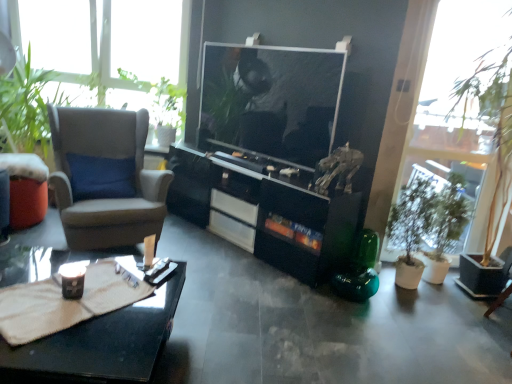
The image size is (512, 384). Find the location of `black glossy cabinet at center`. black glossy cabinet at center is located at coordinates (268, 210).

In order to face green matte plant at right, should I rotate leftwards or rightwards?

It's best to rotate right around 20.157 degrees.

You are a GUI agent. You are given a task and a screenshot of the screen. Output one action in this format:
    pyautogui.click(x=<x>, y=<y>)
    Task: Click on the black glossy coffee table at lower left
    This screenshot has height=384, width=512.
    Given the screenshot: What is the action you would take?
    pyautogui.click(x=101, y=344)

From the image's perspective, which one is positioned higher, matte orange table at left or black glossy cabinet at center?

matte orange table at left, from the image's perspective.

Is matte orange table at left oriented away from black glossy cabinet at center?

No, matte orange table at left is not facing the opposite direction of black glossy cabinet at center.

Can you confirm if matte orange table at left is smaller than black glossy cabinet at center?

Yes.

Would you say matte orange table at left is a long distance from black glossy cabinet at center?

Yes, matte orange table at left and black glossy cabinet at center are quite far apart.

From the picture: From a real-world perspective, is green matte plant at right on top of gray fabric armchair at left?

No.

Between point (451, 212) and point (142, 130), which one is positioned behind?

Positioned behind is point (142, 130).

Considering the positions of objects green matte plant at right and gray fabric armchair at left in the image provided, who is more to the left, green matte plant at right or gray fabric armchair at left?

gray fabric armchair at left is more to the left.

Is green matte plant at right outside of gray fabric armchair at left?

green matte plant at right lies outside gray fabric armchair at left's area.

From the image's perspective, is matte orange table at left on top of green matte plant at right?

Correct, matte orange table at left appears higher than green matte plant at right in the image.

Which is behind, point (42, 175) or point (449, 246)?

Point (449, 246)

Is matte orange table at left next to green matte plant at right and touching it?

No, matte orange table at left is not with green matte plant at right.

Is matte orange table at left facing away from green matte plant at right?

No, green matte plant at right is not at the back of matte orange table at left.

Considering the relative sizes of green matte plant at right and green leafy plant at right in the image provided, is green matte plant at right smaller than green leafy plant at right?

Indeed, green matte plant at right has a smaller size compared to green leafy plant at right.

Is green matte plant at right positioned behind green leafy plant at right?

Yes, it is.

From a real-world perspective, which is physically above, green matte plant at right or green leafy plant at right?

green leafy plant at right.

Is black glossy coffee table at lower left not inside green leafy plant at right?

Absolutely, black glossy coffee table at lower left is external to green leafy plant at right.

Is black glossy coffee table at lower left placed right next to green leafy plant at right?

They are not placed beside each other.

From a real-world perspective, between black glossy coffee table at lower left and green leafy plant at right, who is vertically lower?

black glossy coffee table at lower left, from a real-world perspective.

Does point (60, 119) come farther from viewer compared to point (390, 226)?

No, (60, 119) is in front of (390, 226).

Are gray fabric armchair at left and green matte plant at right making contact?

No, gray fabric armchair at left is not making contact with green matte plant at right.

Based on the photo, do you think gray fabric armchair at left is within green matte plant at right, or outside of it?

gray fabric armchair at left is not enclosed by green matte plant at right.

Which object is positioned more to the right, gray fabric armchair at left or green matte plant at right?

green matte plant at right.

Is matte orange table at left smaller than green leafy plant at right?

Correct, matte orange table at left occupies less space than green leafy plant at right.

Would you say matte orange table at left is a long distance from green leafy plant at right?

Yes, matte orange table at left and green leafy plant at right are quite far apart.

Locate an element on the screen. The height and width of the screenshot is (384, 512). window that is above the matte orange table at left (from the image's perspective) is located at coordinates (460, 160).

Based on the photo, is matte orange table at left situated inside green leafy plant at right or outside?

matte orange table at left is not inside green leafy plant at right, it's outside.

Find the location of a particular element. cabinetry in front of the matte orange table at left is located at coordinates (268, 210).

This screenshot has height=384, width=512. Identify the location of chair above the green matte plant at right (from the image's perspective). (105, 178).

Based on their spatial positions, is black glossy cabinet at center or black glossy coffee table at lower left further from green leafy plant at right?

Based on the image, black glossy coffee table at lower left appears to be further to green leafy plant at right.

Based on their spatial positions, is gray fabric armchair at left or green leafy plant at right closer to black glossy cabinet at center?

gray fabric armchair at left lies closer to black glossy cabinet at center than the other object.

From the image, which object appears to be nearer to black glossy coffee table at lower left, matte orange table at left or gray fabric armchair at left?

Based on the image, gray fabric armchair at left appears to be nearer to black glossy coffee table at lower left.

Which object lies further to the anchor point black glossy cabinet at center, green matte plant at right or green leafy plant at right?

green leafy plant at right lies further to black glossy cabinet at center than the other object.

Based on their spatial positions, is gray fabric armchair at left or green matte plant at right further from black glossy cabinet at center?

gray fabric armchair at left.

Looking at the image, which one is located further to green leafy plant at right, green matte plant at right or matte orange table at left?

matte orange table at left is further to green leafy plant at right.

Estimate the real-world distances between objects in this image. Which object is closer to black glossy coffee table at lower left, green leafy plant at right or green matte plant at right?

green matte plant at right is positioned closer to the anchor black glossy coffee table at lower left.

Based on the photo, from the image, which object appears to be farther from gray fabric armchair at left, black glossy coffee table at lower left or green leafy plant at right?

green leafy plant at right is further to gray fabric armchair at left.

This screenshot has width=512, height=384. I want to click on cabinetry between gray fabric armchair at left and green leafy plant at right in the horizontal direction, so click(x=268, y=210).

Where is `cabinetry situated between matte orange table at left and green leafy plant at right from left to right`? cabinetry situated between matte orange table at left and green leafy plant at right from left to right is located at coordinates (268, 210).

You are a GUI agent. You are given a task and a screenshot of the screen. Output one action in this format:
    pyautogui.click(x=<x>, y=<y>)
    Task: Click on the chair situated between matte orange table at left and green leafy plant at right from left to right
    The image size is (512, 384).
    Given the screenshot: What is the action you would take?
    pyautogui.click(x=105, y=178)

This screenshot has height=384, width=512. I want to click on cabinetry between black glossy coffee table at lower left and green leafy plant at right from left to right, so click(x=268, y=210).